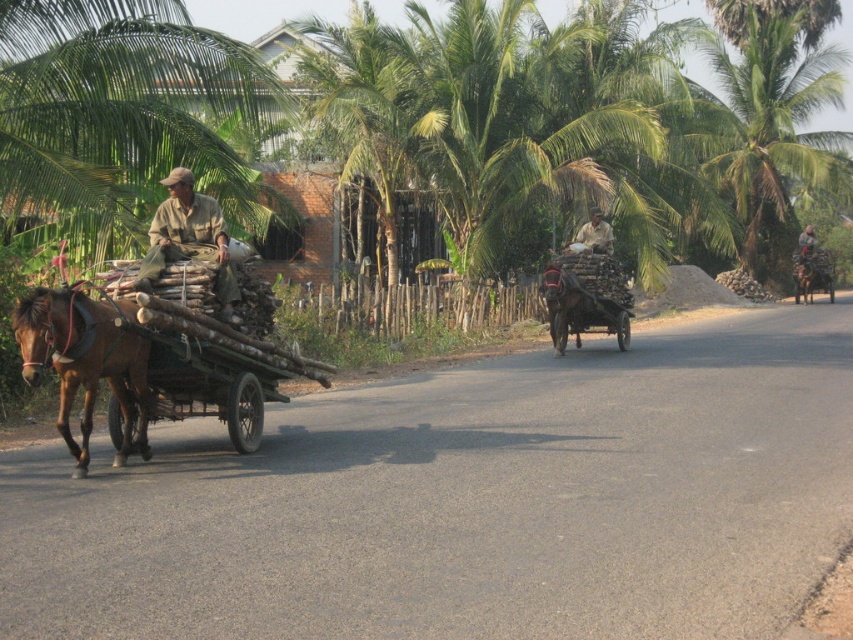
Is wooden cart at center bigger than khaki cotton shirt at center?

Yes.

Is point (550, 272) positioned in front of point (606, 252)?

Yes, it is.

Find the location of a particular element. This screenshot has height=640, width=853. wooden cart at center is located at coordinates (579, 308).

Which of these two, green leafy coconut tree at upper right or brown cotton shirt at left, stands shorter?

brown cotton shirt at left is shorter.

Can you confirm if green leafy coconut tree at upper right is shorter than brown cotton shirt at left?

Incorrect, green leafy coconut tree at upper right's height does not fall short of brown cotton shirt at left's.

What do you see at coordinates (769, 120) in the screenshot? The width and height of the screenshot is (853, 640). I see `green leafy coconut tree at upper right` at bounding box center [769, 120].

Locate an element on the screen. This screenshot has width=853, height=640. green leafy coconut tree at upper right is located at coordinates (769, 120).

Who is positioned more to the right, brown cotton shirt at left or wooden cart at center?

wooden cart at center is more to the right.

Is point (222, 252) closer to viewer compared to point (614, 307)?

Yes, point (222, 252) is in front of point (614, 307).

Which is behind, point (151, 248) or point (599, 305)?

The point (599, 305) is behind.

This screenshot has width=853, height=640. Identify the location of brown cotton shirt at left. (189, 237).